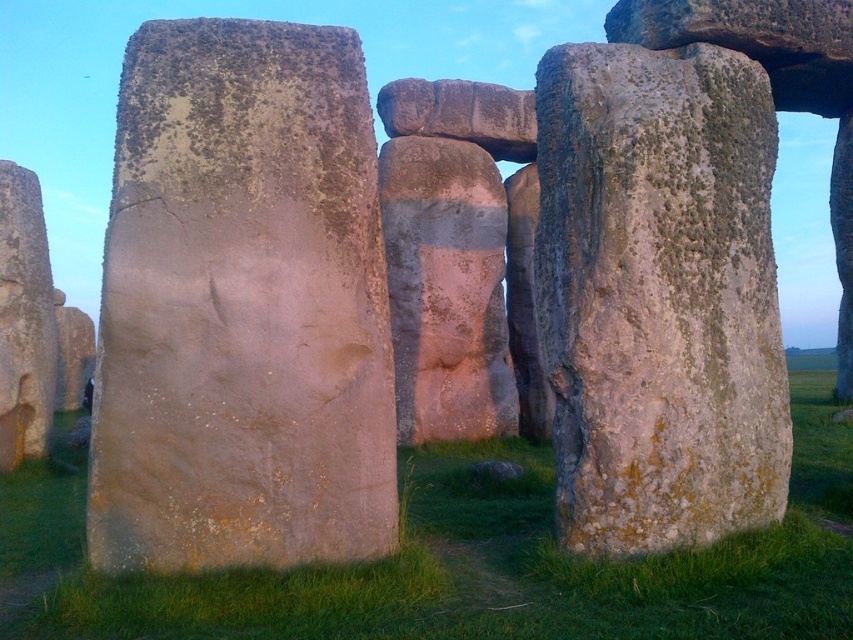
Question: Based on their relative distances, which object is farther from the speckled stone boulder at center?

Choices:
 (A) green grass at center
 (B) rusty stone boulder at center

Answer: (B)

Question: Is speckled stone boulder at center in front of green grass at center?

Choices:
 (A) no
 (B) yes

Answer: (A)

Question: Among these points, which one is farthest from the camera?

Choices:
 (A) (306, 152)
 (B) (795, 522)

Answer: (B)

Question: Is speckled stone boulder at center further to camera compared to green grass at center?

Choices:
 (A) yes
 (B) no

Answer: (A)

Question: Does speckled stone boulder at center have a lesser width compared to green grass at center?

Choices:
 (A) no
 (B) yes

Answer: (B)

Question: Which of the following is the closest to the observer?

Choices:
 (A) speckled stone boulder at center
 (B) rusty stone boulder at center

Answer: (B)